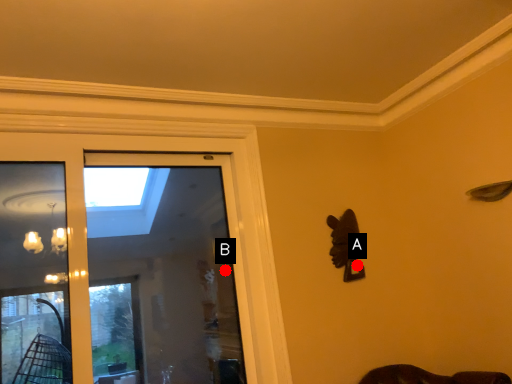
Question: Two points are circled on the image, labeled by A and B beside each circle. Which point is closer to the camera taking this photo?

Choices:
 (A) A is closer
 (B) B is closer

Answer: (A)